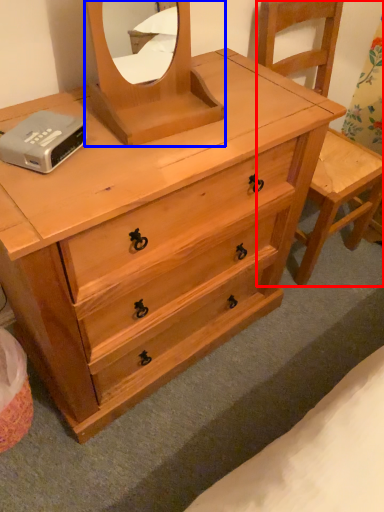
Question: Which of the following is the closest to the observer, armchair (highlighted by a red box) or mirror (highlighted by a blue box)?

Choices:
 (A) armchair
 (B) mirror

Answer: (B)